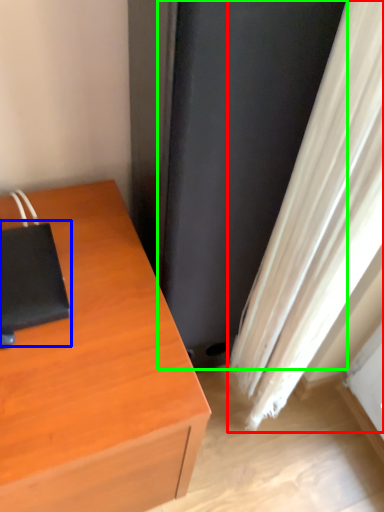
Question: Based on their relative distances, which object is farther from curtain (highlighted by a red box)? Choose from notebook (highlighted by a blue box) and screen door (highlighted by a green box).

Choices:
 (A) notebook
 (B) screen door

Answer: (A)